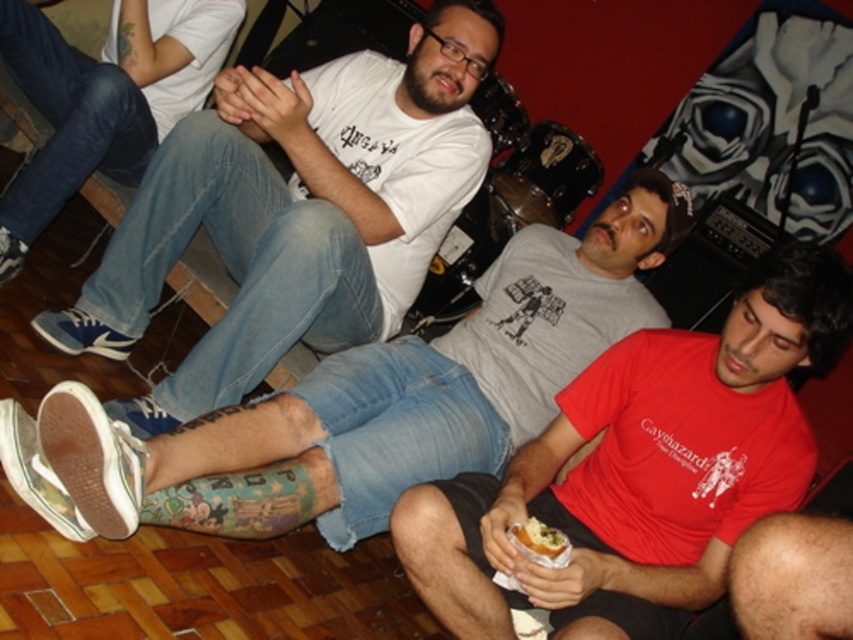
Question: Is white canvas shoe at lower left to the right of denim jeans at center from the viewer's perspective?

Choices:
 (A) no
 (B) yes

Answer: (B)

Question: Estimate the real-world distances between objects in this image. Which object is farther from the red matte shirt at lower right?

Choices:
 (A) white matte t-shirt at center
 (B) denim jeans at center
 (C) white bread at lower center

Answer: (B)

Question: Which point is farther to the camera?

Choices:
 (A) (790, 416)
 (B) (358, 525)
 (C) (293, 193)
 (D) (526, 531)

Answer: (C)

Question: In this image, where is white matte t-shirt at center located relative to white canvas shoe at lower left?

Choices:
 (A) left
 (B) right

Answer: (A)

Question: Is white matte t-shirt at center wider than white bread at lower center?

Choices:
 (A) no
 (B) yes

Answer: (B)

Question: Which of these objects is positioned farthest from the white matte t-shirt at center?

Choices:
 (A) white bread at lower center
 (B) denim jeans at center
 (C) white canvas shoe at lower left

Answer: (A)